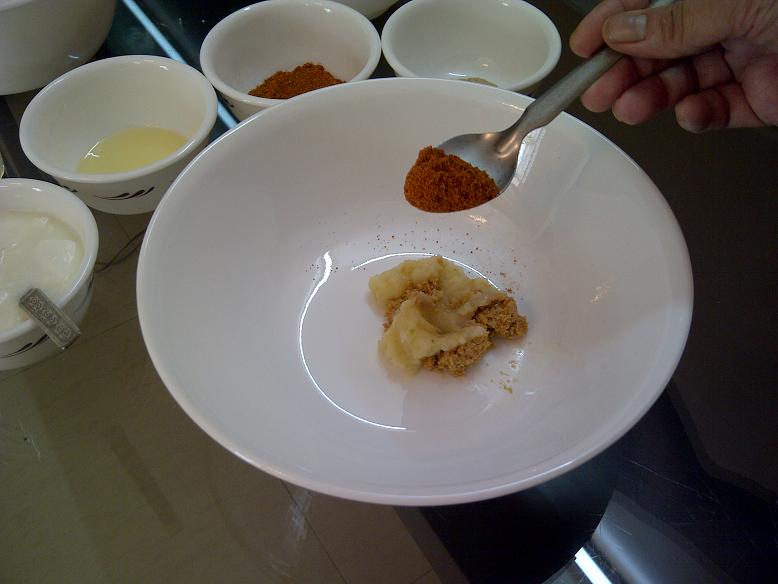
Where is `table`? This screenshot has height=584, width=778. table is located at coordinates (216, 534).